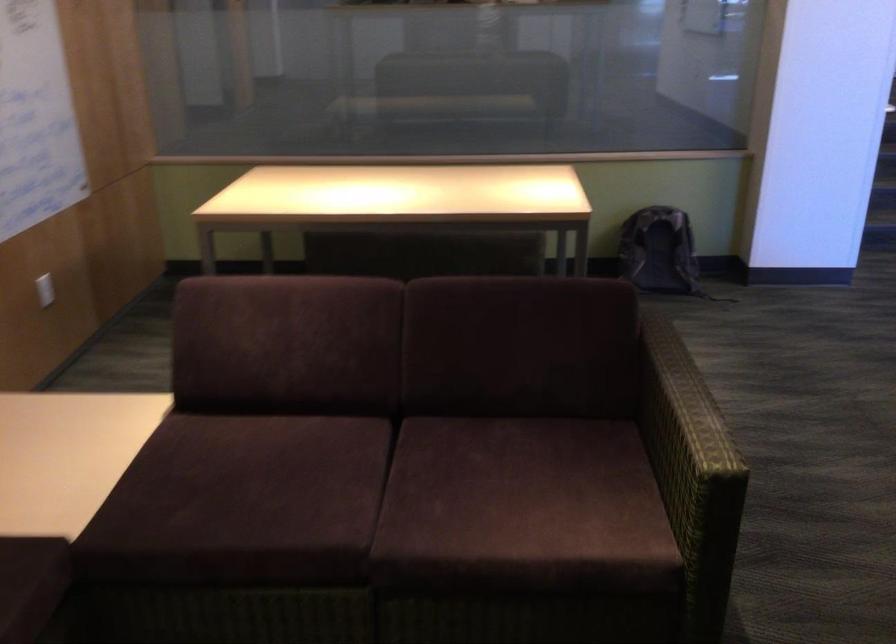
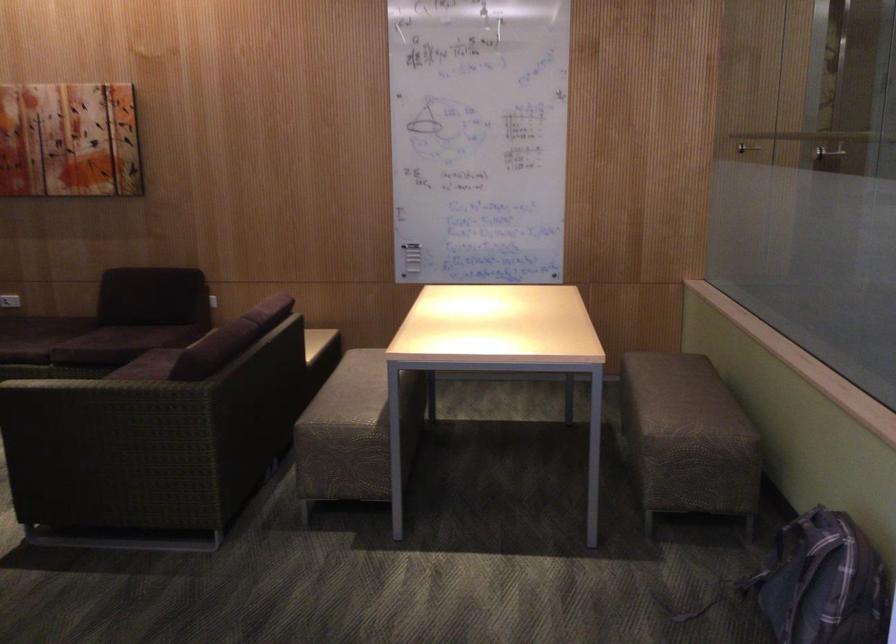
The point at (690, 422) is marked in the first image. Where is the corresponding point in the second image?

(96, 382)